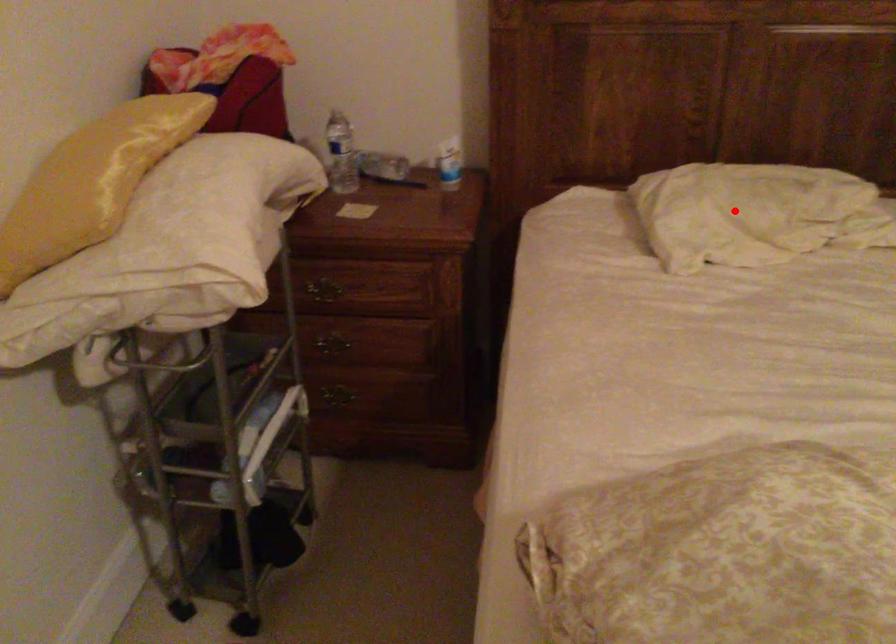
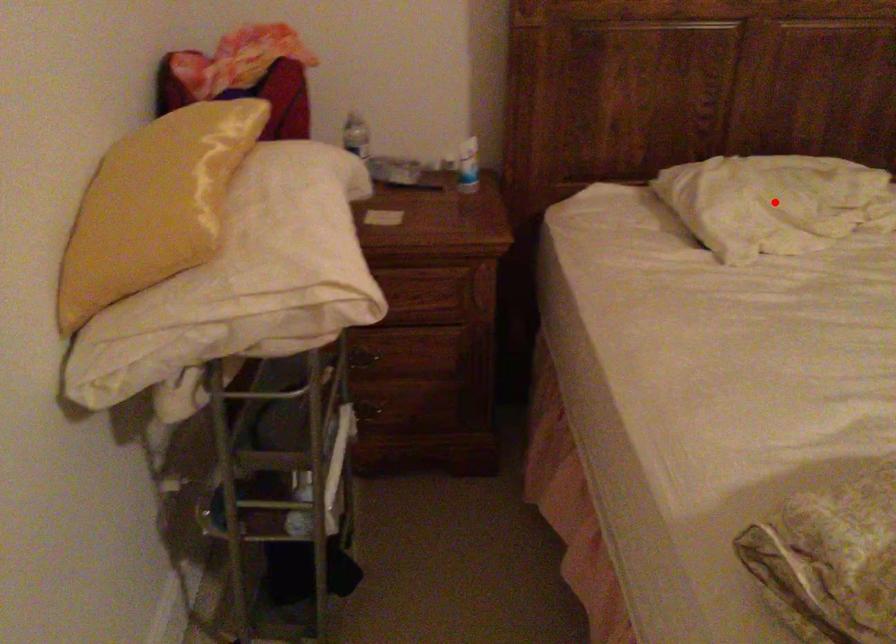
I am providing you with two images of the same scene from different viewpoints. A red point is marked on the first image and another point is marked on the second image. Is the marked point in image1 the same physical position as the marked point in image2?

Yes